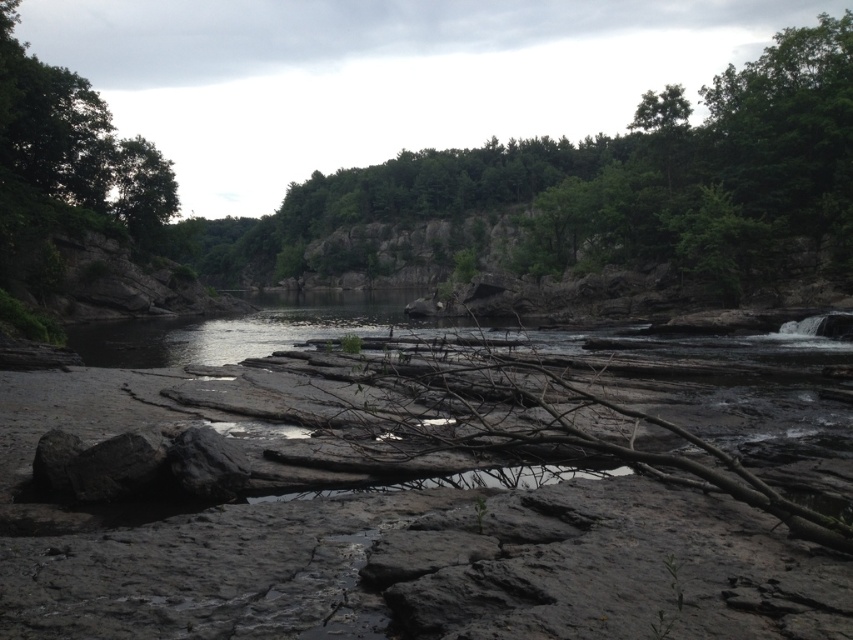
You are an environmental scientist assessing the canopy coverage in this landscape. Given the presence of the green leafy tree at upper center and the green leafy tree at upper left, which tree would likely cast a larger shadow on the ground below during midday?

The green leafy tree at upper center might cast a larger shadow on the ground below during midday since it is wider than the green leafy tree at upper left.

You are a hiker trying to determine which tree is taller between the green leafy tree at upper center and the green leafy tree at upper left. Based on the scene, which one should you identify as the taller tree?

The green leafy tree at upper center is taller than the green leafy tree at upper left.